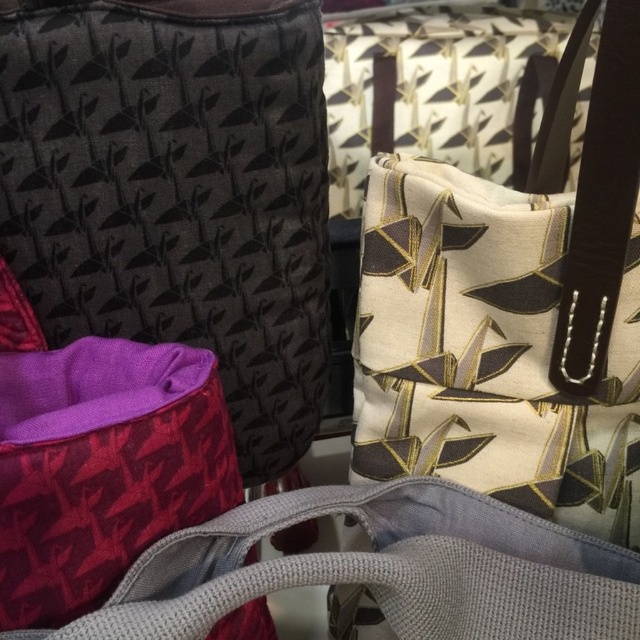
Does purple fabric bag at lower left have a larger size compared to matte purple fabric bag at lower left?

Indeed, purple fabric bag at lower left has a larger size compared to matte purple fabric bag at lower left.

I want to click on purple fabric bag at lower left, so click(x=177, y=192).

The width and height of the screenshot is (640, 640). I want to click on purple fabric bag at lower left, so click(x=177, y=192).

Can you confirm if matte black fabric bag at center is thinner than matte purple fabric bag at lower left?

Yes.

Is point (589, 22) farther from camera compared to point (253, 582)?

Yes.

Is point (557, 468) in front of point (273, 563)?

No.

This screenshot has height=640, width=640. Find the location of `matte black fabric bag at center`. matte black fabric bag at center is located at coordinates (513, 310).

Is point (253, 19) closer to camera compared to point (484, 321)?

Yes, it is in front of point (484, 321).

Is purple fabric bag at lower left wider than matte black fabric bag at center?

Yes, purple fabric bag at lower left is wider than matte black fabric bag at center.

Between point (257, 196) and point (401, 202), which one is positioned in front?

Positioned in front is point (401, 202).

At what (x,y) coordinates should I click in order to perform the action: click on purple fabric bag at lower left. Please return your answer as a coordinate pair (x, y). Image resolution: width=640 pixels, height=640 pixels. Looking at the image, I should click on (177, 192).